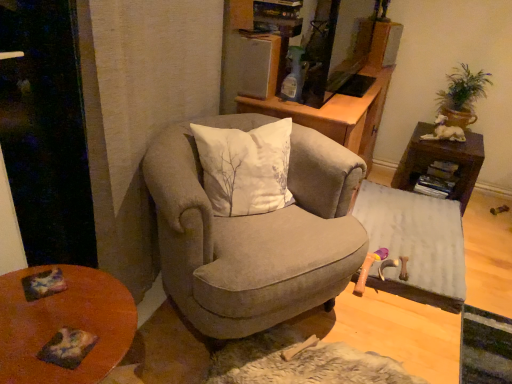
Locate an element on the screen. The width and height of the screenshot is (512, 384). vacant space situated above wooden table at lower left (from a real-world perspective) is located at coordinates (61, 311).